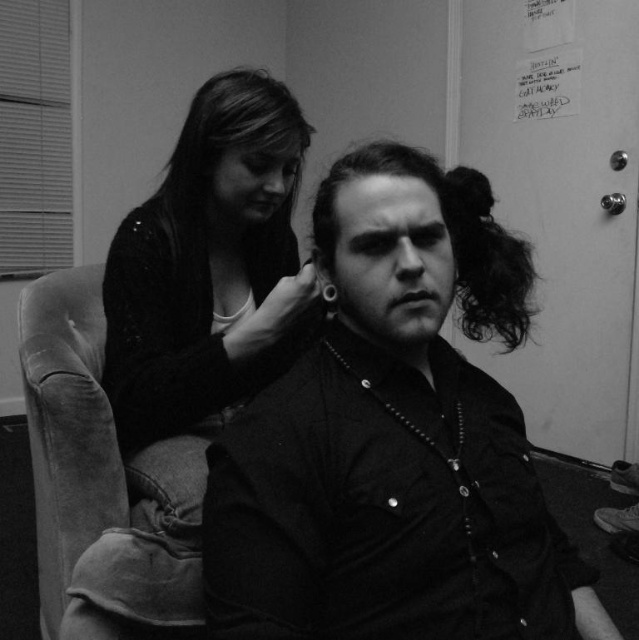
You are a photographer who needs to adjust the lighting in the scene. The matte black shirt at center and the matte black sweater at upper left are both in the frame. Which object should you focus the light on to ensure it appears brighter in the final photo?

The matte black sweater at upper left should be focused on because it is located above the matte black shirt at center, making it closer to the light source if the light is coming from above, thus requiring less adjustment to appear brighter.

You are a photographer setting up a shoot in this indoor scene. You need to place a light to the left of the matte black sweater at upper left and another light to the right of the matte black shirt at center. Will the two lights be positioned on the same side relative to the photographer?

The matte black shirt at center is to the right of the matte black sweater at upper left. Therefore, placing a light to the left of the matte black sweater at upper left and another to the right of the matte black shirt at center would mean the two lights are on opposite sides relative to the photographer.

You are a photographer trying to capture a closeup of the dark curly hair at center without the matte black shirt at center showing in the frame. Based on their positions, is this possible?

The matte black shirt at center is located below dark curly hair at center, so if you angle the camera upwards to focus on the dark curly hair at center, the shirt should not be visible in the frame.